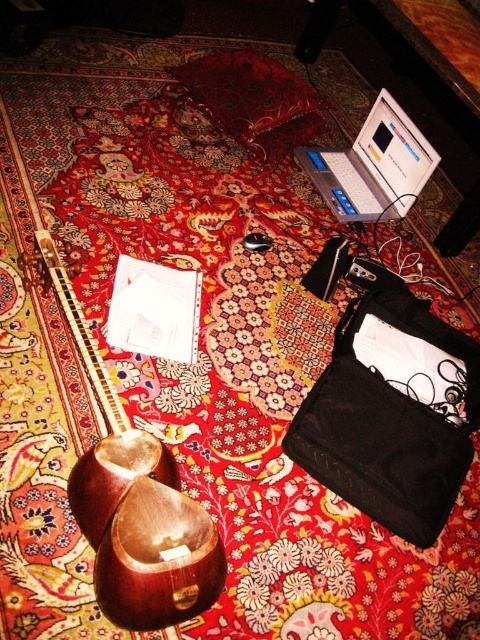
Consider the image. You are organizing a study area in this room and want to place your silver metallic laptop at upper right closer to the wooden stringed instrument at lower left. Which direction should you move the laptop to bring it closer to the instrument?

To move the silver metallic laptop at upper right closer to the wooden stringed instrument at lower left, you should move it downward since the instrument is located below the laptop.